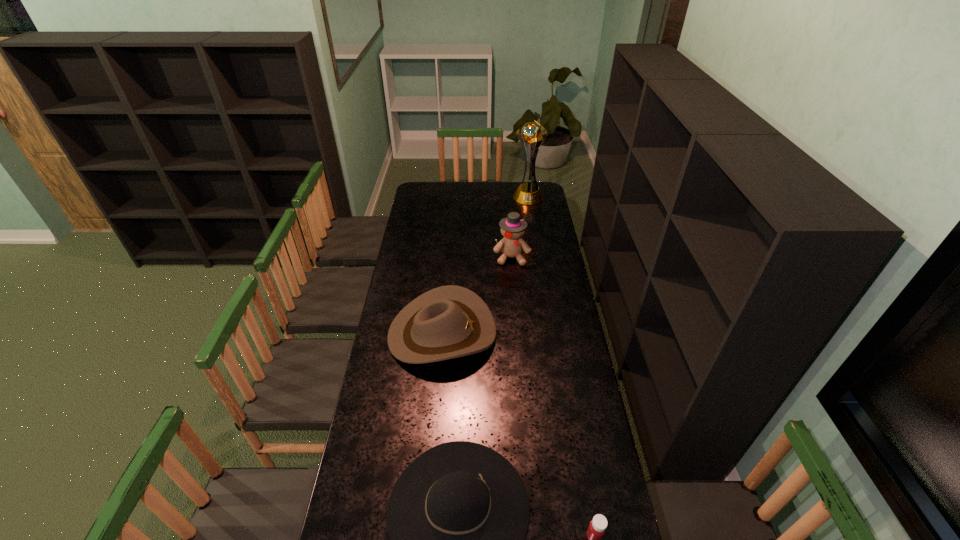
The image size is (960, 540). In order to click on object situated at the left edge in this screenshot , I will do `click(447, 322)`.

Locate an element on the screen. The image size is (960, 540). object at the right edge is located at coordinates (532, 133).

You are a GUI agent. You are given a task and a screenshot of the screen. Output one action in this format:
    pyautogui.click(x=<x>, y=<y>)
    Task: Click on the object present at the far right corner
    Image resolution: width=960 pixels, height=540 pixels.
    Given the screenshot: What is the action you would take?
    pyautogui.click(x=532, y=133)

Image resolution: width=960 pixels, height=540 pixels. In the image, there is a desktop. Find the location of `vacant space at the far edge`. vacant space at the far edge is located at coordinates (483, 193).

The height and width of the screenshot is (540, 960). In order to click on free space at the left edge in this screenshot , I will do `click(385, 394)`.

Where is `vacant space at the right edge`? This screenshot has height=540, width=960. vacant space at the right edge is located at coordinates (575, 474).

At what (x,y) coordinates should I click in order to perform the action: click on empty space that is in between the third tallest object and the trophy. Please return your answer as a coordinate pair (x, y). Looking at the image, I should click on (485, 265).

Locate which object is the third closest to the fourth nearest object. Please provide its 2D coordinates. Your answer should be formatted as a tuple, i.e. [(x, y)], where the tuple contains the x and y coordinates of a point satisfying the conditions above.

[(457, 517)]

The width and height of the screenshot is (960, 540). Identify the location of object that is the third closest to the rag_doll. point(457,517).

The height and width of the screenshot is (540, 960). I want to click on free point that satisfies the following two spatial constraints: 1. on the front-facing side of the trophy; 2. with a star on the front of the third farthest object, so click(x=549, y=333).